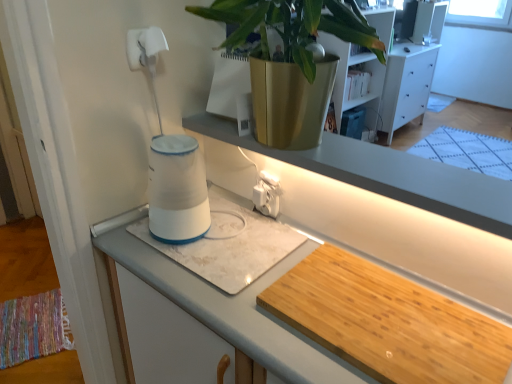
Question: From the image's perspective, would you say white plastic electric outlet at center is positioned over white glossy cup at center, which is counted as the 1th wide, starting from the left?

Choices:
 (A) no
 (B) yes

Answer: (B)

Question: Does white plastic electric outlet at center lie in front of white glossy cup at center, placed as the 2th wide when sorted from right to left?

Choices:
 (A) yes
 (B) no

Answer: (B)

Question: Considering the relative sizes of white plastic electric outlet at center and white glossy cup at center, placed as the 2th wide when sorted from right to left, in the image provided, is white plastic electric outlet at center bigger than white glossy cup at center, placed as the 2th wide when sorted from right to left,?

Choices:
 (A) yes
 (B) no

Answer: (B)

Question: Is white glossy cup at center, placed as the 2th wide when sorted from right to left, at the back of white plastic electric outlet at center?

Choices:
 (A) no
 (B) yes

Answer: (A)

Question: Would you say white plastic electric outlet at center contains white glossy cup at center, placed as the 2th wide when sorted from right to left?

Choices:
 (A) yes
 (B) no

Answer: (B)

Question: Is white glossy cup at center, which is counted as the 1th wide, starting from the left, to the left or to the right of white plastic electric outlet at center in the image?

Choices:
 (A) left
 (B) right

Answer: (A)

Question: Is white glossy cup at center, which is counted as the 1th wide, starting from the left, in front of or behind white plastic electric outlet at center in the image?

Choices:
 (A) behind
 (B) front

Answer: (B)

Question: Does point click(x=197, y=259) appear closer or farther from the camera than point click(x=274, y=210)?

Choices:
 (A) farther
 (B) closer

Answer: (B)

Question: Is white glossy cup at center, which is counted as the 1th wide, starting from the left, inside or outside of white plastic electric outlet at center?

Choices:
 (A) inside
 (B) outside

Answer: (B)

Question: From a real-world perspective, is white glossy water heater at center above or below wooden cutting board at lower right, which is the 2th wide from left to right?

Choices:
 (A) below
 (B) above

Answer: (B)

Question: Is white glossy water heater at center to the left or to the right of wooden cutting board at lower right, which ranks as the 1th wide in right-to-left order, in the image?

Choices:
 (A) right
 (B) left

Answer: (B)

Question: From their relative heights in the image, would you say white glossy water heater at center is taller or shorter than wooden cutting board at lower right, which ranks as the 1th wide in right-to-left order?

Choices:
 (A) short
 (B) tall

Answer: (B)

Question: Is white glossy water heater at center situated inside wooden cutting board at lower right, which is the 2th wide from left to right, or outside?

Choices:
 (A) inside
 (B) outside

Answer: (B)

Question: Is white laminate cabinet at center wider or thinner than white glossy water heater at center?

Choices:
 (A) wide
 (B) thin

Answer: (A)

Question: Considering the positions of white laminate cabinet at center and white glossy water heater at center in the image, is white laminate cabinet at center taller or shorter than white glossy water heater at center?

Choices:
 (A) short
 (B) tall

Answer: (B)